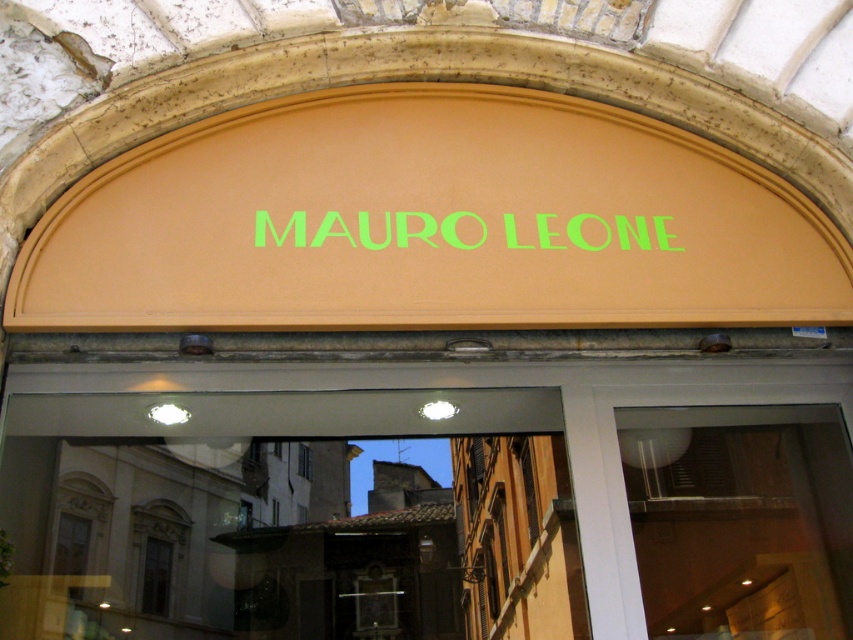
You are a delivery person standing in front of the MAURO LEONE shop entrance. You need to deliver a package to the store. The package is 3 meters long. Can you fit the package through the transparent glass door at center without tilting it? Explain your reasoning.

The transparent glass door at center is 3.17 meters away from the camera. Since the package is 3 meters long, it is shorter than the distance available, so the package can fit through the transparent glass door at center without tilting it.

You are a delivery person trying to enter the shop MAURO LEONE. You see the transparent glass door at center and the green matte sign at center. Which object should you interact with to enter the shop?

You should interact with the transparent glass door at center to enter the shop, as it is the entrance. The green matte sign at center indicates the shop name but does not provide access.